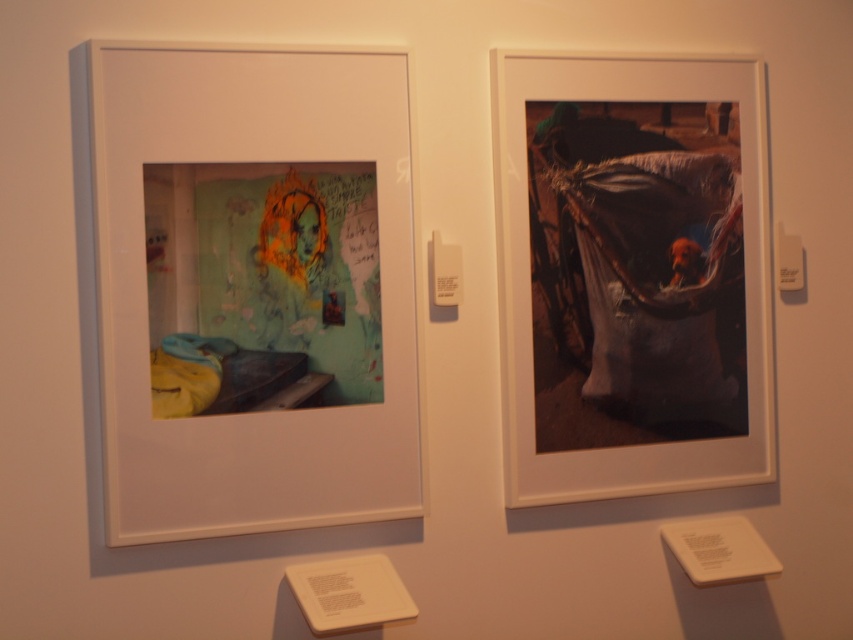
Question: Which point is farther to the camera?

Choices:
 (A) matte paper picture frame at left
 (B) matte plastic bag at right

Answer: (B)

Question: Observing the image, what is the correct spatial positioning of matte plastic bag at right in reference to matte paper picture frame at left?

Choices:
 (A) above
 (B) below

Answer: (A)

Question: Is matte plastic bag at right to the left of matte paper picture frame at left from the viewer's perspective?

Choices:
 (A) no
 (B) yes

Answer: (A)

Question: Among these points, which one is farthest from the camera?

Choices:
 (A) (403, 326)
 (B) (602, 390)

Answer: (B)

Question: Is matte plastic bag at right thinner than matte paper picture frame at left?

Choices:
 (A) no
 (B) yes

Answer: (A)

Question: Among these objects, which one is farthest from the camera?

Choices:
 (A) matte plastic bag at right
 (B) matte paper picture frame at left

Answer: (A)